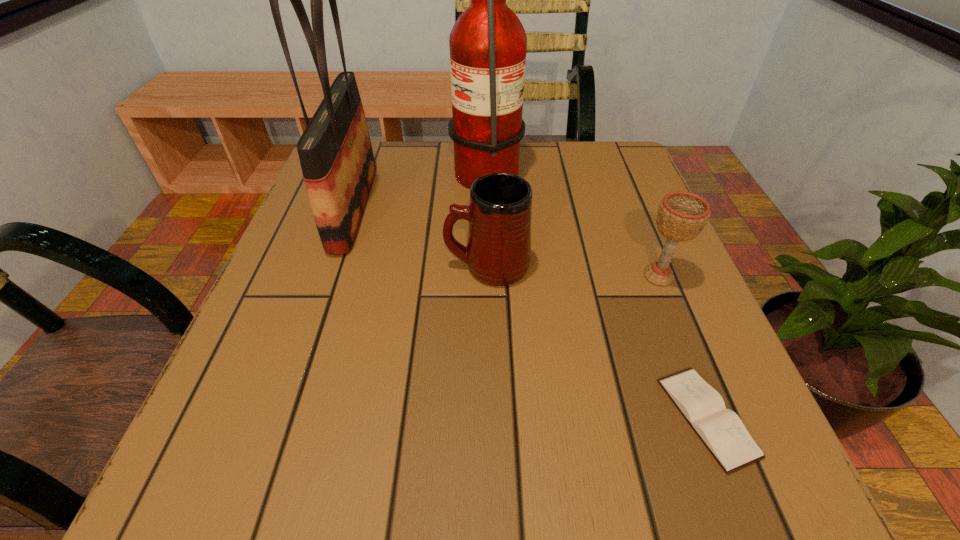
You are a GUI agent. You are given a task and a screenshot of the screen. Output one action in this format:
    pyautogui.click(x=<x>, y=<y>)
    Task: Click on the fire extinguisher
    Image resolution: width=960 pixels, height=540 pixels.
    Given the screenshot: What is the action you would take?
    pyautogui.click(x=488, y=44)

Identify the location of the second tallest object. Image resolution: width=960 pixels, height=540 pixels. (335, 152).

Image resolution: width=960 pixels, height=540 pixels. What are the coordinates of `shopping bag` in the screenshot? It's located at (335, 152).

You are a GUI agent. You are given a task and a screenshot of the screen. Output one action in this format:
    pyautogui.click(x=<x>, y=<y>)
    Task: Click on the mug
    The image size is (960, 540).
    Given the screenshot: What is the action you would take?
    pyautogui.click(x=498, y=253)

Locate an element on the screen. chalice is located at coordinates (681, 216).

Find the location of a particular element. the nearest object is located at coordinates point(721,430).

Identify the location of the shortest object. (721, 430).

At what (x,y) coordinates should I click in order to perform the action: click on free space located on the nozzle and handle of the fire extinguisher. Please return your answer as a coordinate pair (x, y). The width and height of the screenshot is (960, 540). Looking at the image, I should click on (349, 166).

This screenshot has height=540, width=960. Find the location of `vacant space located on the nozzle and handle of the fire extinguisher`. vacant space located on the nozzle and handle of the fire extinguisher is located at coordinates (418, 166).

Where is `free space located on the nozzle and handle of the fire extinguisher`? free space located on the nozzle and handle of the fire extinguisher is located at coordinates (400, 166).